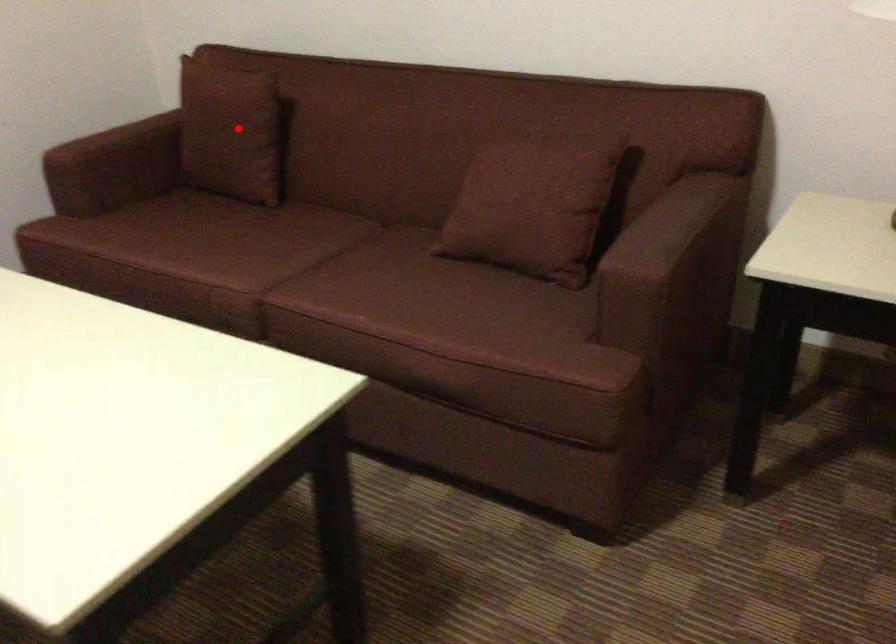
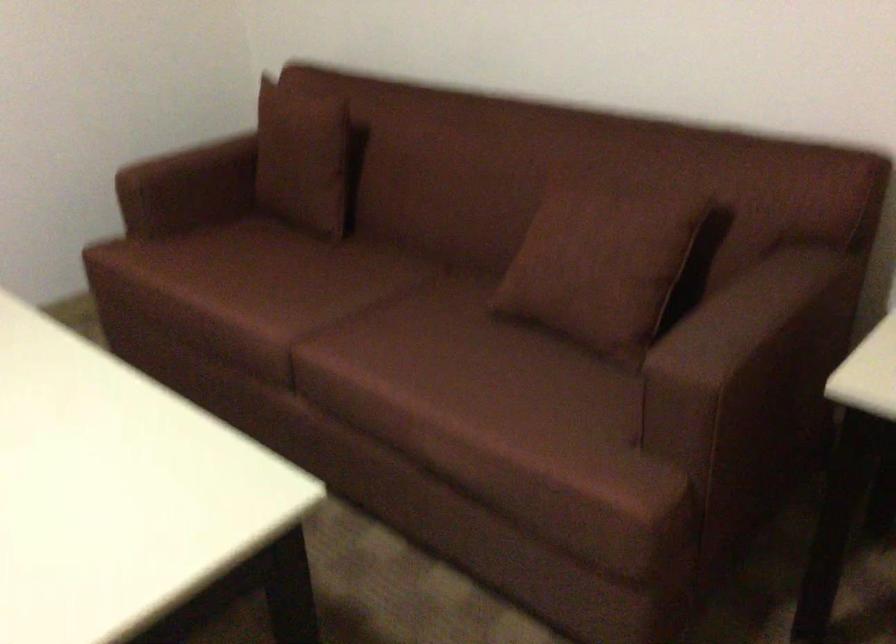
The point at the highlighted location is marked in the first image. Where is the corresponding point in the second image?

(306, 158)